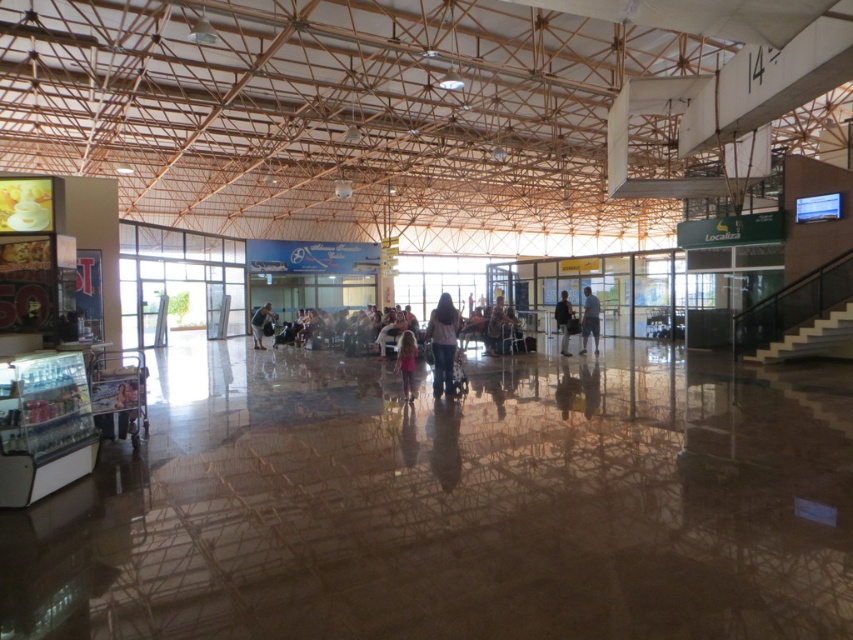
Can you confirm if light pink fabric dress at center is bigger than light blue jeans at center?

Yes, light pink fabric dress at center is bigger than light blue jeans at center.

Can you confirm if light pink fabric dress at center is thinner than light blue jeans at center?

No, light pink fabric dress at center is not thinner than light blue jeans at center.

Is point (451, 308) farther from viewer compared to point (596, 301)?

No, it is in front of (596, 301).

This screenshot has height=640, width=853. Identify the location of light pink fabric dress at center. (444, 342).

Is dark blue jacket at center above matte black backpack at center?

Correct, dark blue jacket at center is located above matte black backpack at center.

Is point (569, 355) closer to camera compared to point (258, 332)?

Yes.

The width and height of the screenshot is (853, 640). I want to click on dark blue jacket at center, so click(563, 321).

Can you confirm if pink fabric dress at center is positioned to the left of dark blue jacket at center?

Correct, you'll find pink fabric dress at center to the left of dark blue jacket at center.

Who is lower down, pink fabric dress at center or dark blue jacket at center?

pink fabric dress at center is lower down.

Is point (407, 396) closer to viewer compared to point (554, 314)?

Yes, point (407, 396) is closer to viewer.

Locate an element on the screen. pink fabric dress at center is located at coordinates (407, 364).